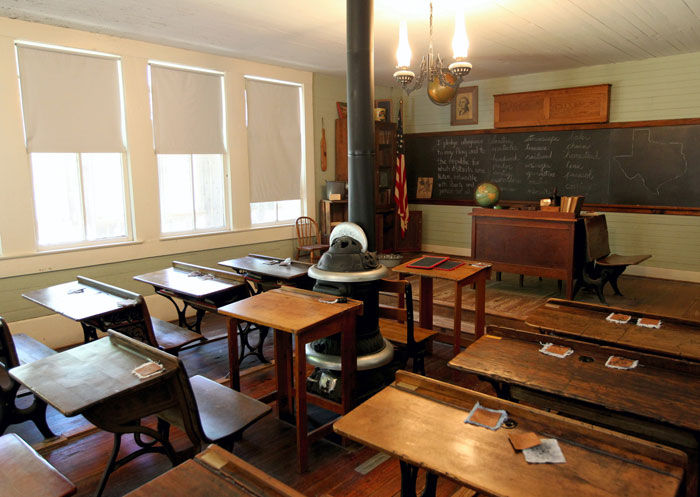
The height and width of the screenshot is (497, 700). I want to click on chalkboard, so click(x=600, y=170).